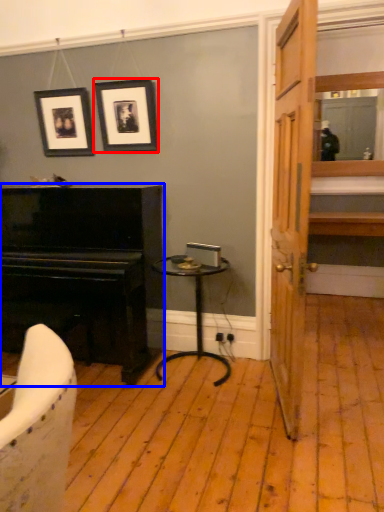
Question: Among these objects, which one is farthest to the camera, picture frame (highlighted by a red box) or piano (highlighted by a blue box)?

Choices:
 (A) picture frame
 (B) piano

Answer: (A)